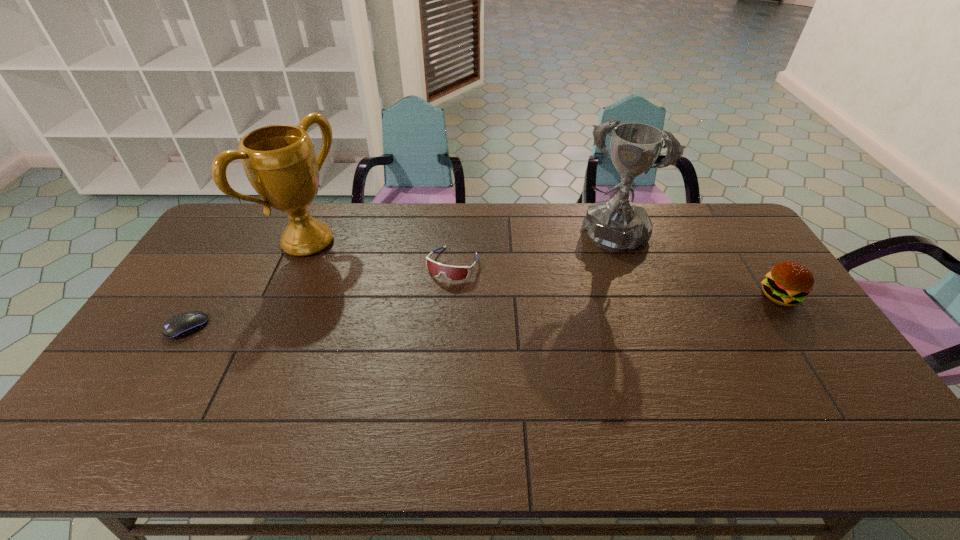
Where is `vacant area that lies between the rightmost object and the second object from left to right`? Image resolution: width=960 pixels, height=540 pixels. vacant area that lies between the rightmost object and the second object from left to right is located at coordinates (544, 269).

Where is `empty location between the left award and the hamburger`? The height and width of the screenshot is (540, 960). empty location between the left award and the hamburger is located at coordinates (544, 269).

Where is `empty space that is in between the goggles and the nearest object`? The height and width of the screenshot is (540, 960). empty space that is in between the goggles and the nearest object is located at coordinates (320, 296).

Where is `unoccupied area between the goggles and the nearest object`? The image size is (960, 540). unoccupied area between the goggles and the nearest object is located at coordinates (320, 296).

The width and height of the screenshot is (960, 540). I want to click on vacant region between the third shortest object and the left award, so click(544, 269).

The height and width of the screenshot is (540, 960). I want to click on vacant space in between the left award and the right award, so click(x=459, y=239).

Where is `object that is the fourth closest to the left award`? The width and height of the screenshot is (960, 540). object that is the fourth closest to the left award is located at coordinates (788, 283).

Where is `the third closest object to the left award`? The height and width of the screenshot is (540, 960). the third closest object to the left award is located at coordinates (616, 225).

You are a GUI agent. You are given a task and a screenshot of the screen. Output one action in this format:
    pyautogui.click(x=<x>, y=<y>)
    Task: Click on the free spot that satisfies the following two spatial constraints: 1. on the back side of the shortest object; 2. on the left side of the hamburger
    Image resolution: width=960 pixels, height=540 pixels.
    Given the screenshot: What is the action you would take?
    pyautogui.click(x=205, y=296)

The width and height of the screenshot is (960, 540). Find the location of `vacant region that satisfies the following two spatial constraints: 1. on the back side of the second shortest object; 2. on the right side of the right award`. vacant region that satisfies the following two spatial constraints: 1. on the back side of the second shortest object; 2. on the right side of the right award is located at coordinates click(454, 236).